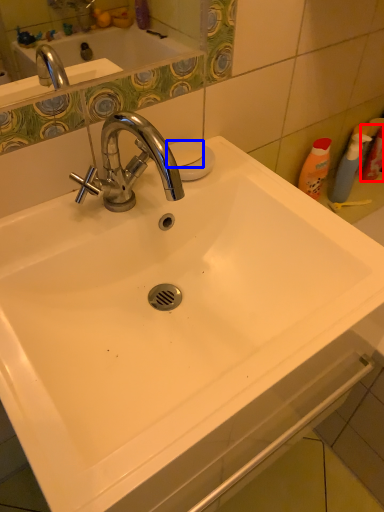
Question: Which of the following is the farthest to the observer, cleaning product (highlighted by a red box) or soap (highlighted by a blue box)?

Choices:
 (A) cleaning product
 (B) soap

Answer: (A)